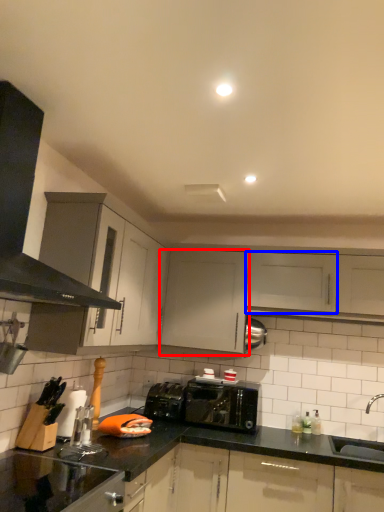
Question: Which point is further to the camera, cabinetry (highlighted by a red box) or cabinetry (highlighted by a blue box)?

Choices:
 (A) cabinetry
 (B) cabinetry

Answer: (A)